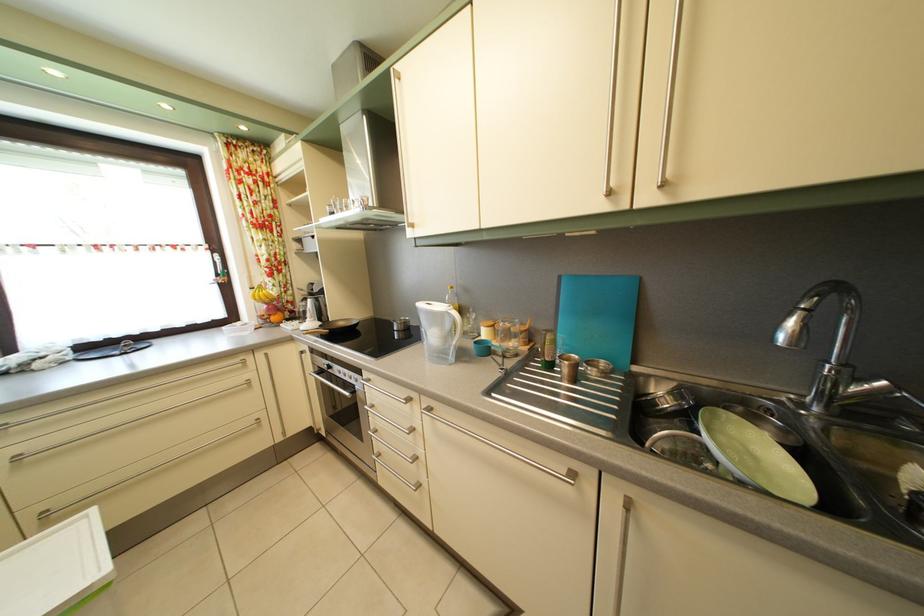
Describe the element at coordinates (342, 407) in the screenshot. I see `the oven door handle` at that location.